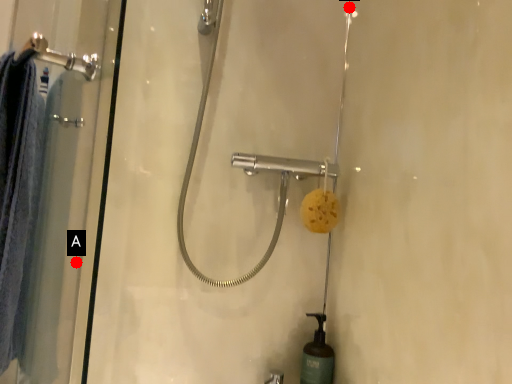
Question: Two points are circled on the image, labeled by A and B beside each circle. Which point is further to the camera?

Choices:
 (A) A is further
 (B) B is further

Answer: (B)